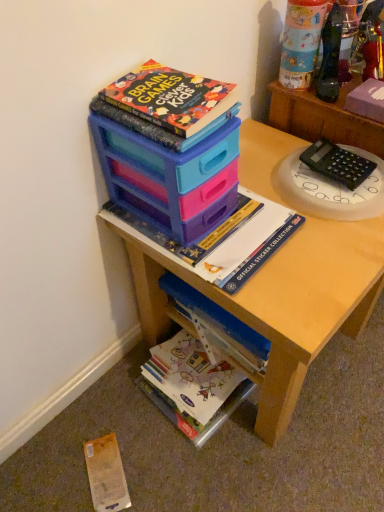
Question: Relative to hardcover book at upper center, which is counted as the 1th book, starting from the top, is white glossy book at lower center, the 3th book in the top-to-bottom sequence, in front or behind?

Choices:
 (A) front
 (B) behind

Answer: (B)

Question: From a real-world perspective, is white glossy book at lower center, which is the 1th book from bottom to top, positioned above or below hardcover book at upper center, the 3th book when ordered from bottom to top?

Choices:
 (A) below
 (B) above

Answer: (A)

Question: Which of these objects is positioned farthest from the black plastic calculator at upper right?

Choices:
 (A) white glossy book at lower center, the 3th book in the top-to-bottom sequence
 (B) matte plastic cup at upper right
 (C) matte plastic storage at upper center, the second book from the top
 (D) matte plastic storage box at upper center
 (E) wooden desk at center

Answer: (A)

Question: Which object is positioned closest to the wooden desk at center?

Choices:
 (A) matte plastic storage at upper center, the 2th book in the bottom-to-top sequence
 (B) black plastic calculator at upper right
 (C) yellow paper at lower left
 (D) hardcover book at upper center, which is counted as the 1th book, starting from the top
 (E) white glossy book at lower center, the 3th book in the top-to-bottom sequence

Answer: (A)